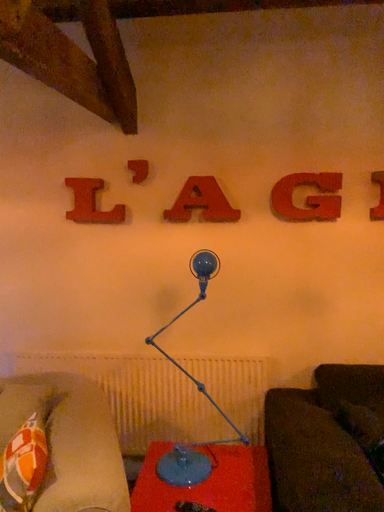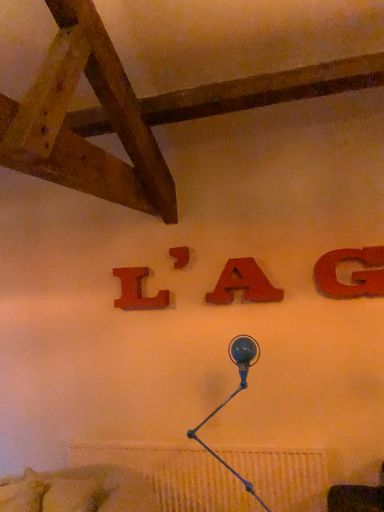
Question: How did the camera likely rotate when shooting the video?

Choices:
 (A) rotated downward
 (B) rotated upward

Answer: (B)